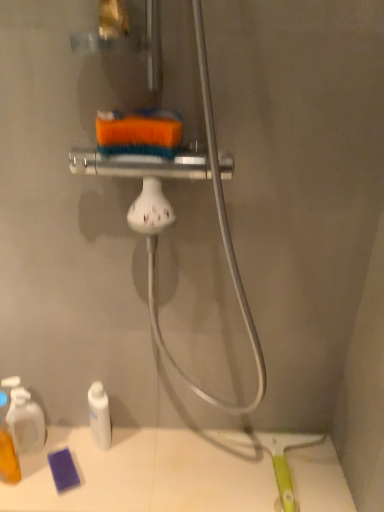
Identify the location of vacant area that lies between translucent plastic spray bottle at lower left, placed as the second toiletry when sorted from right to left, and white matte bottle at lower left, which is the 3th toiletry from left to right. (67, 446).